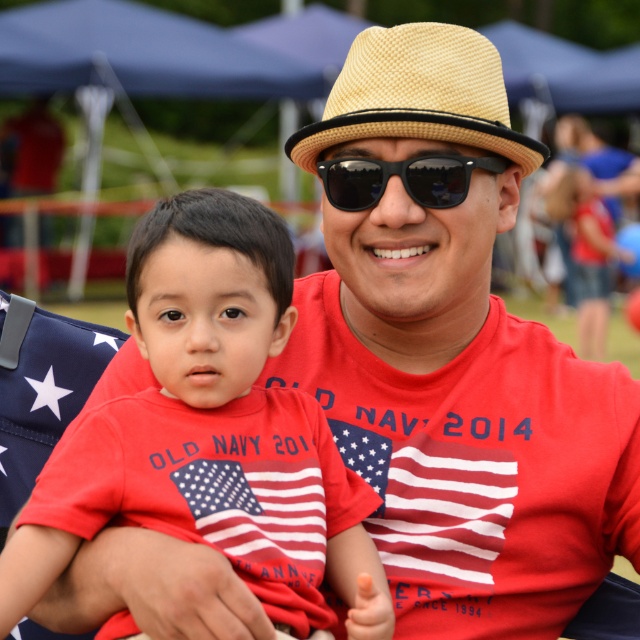
You are at a festival and need to locate the beige straw hat at center and the american flag fabric at left. Which object is positioned to the right of the other?

The beige straw hat at center is positioned to the right of the american flag fabric at left.